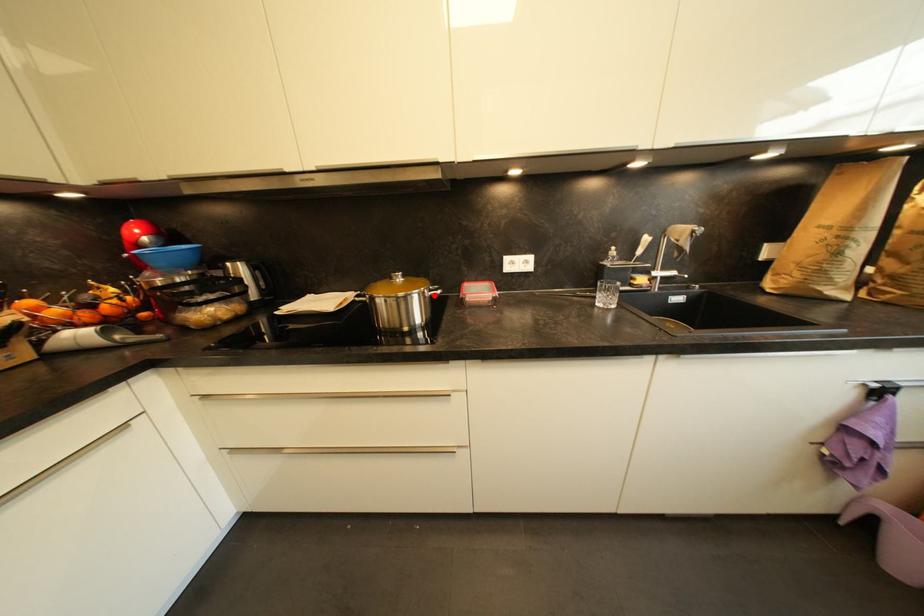
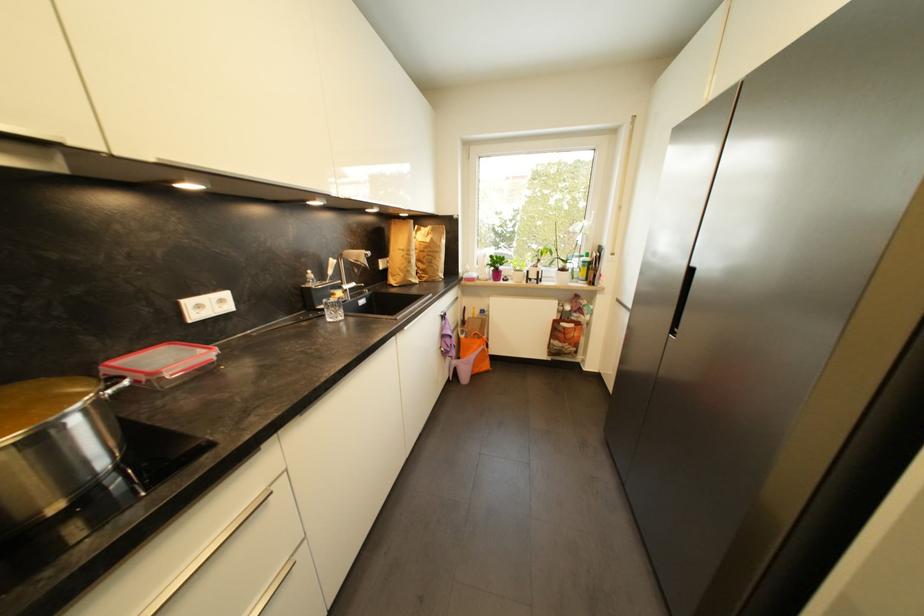
Find the pixel in the second image that matches the highlighted location in the first image.

(114, 394)